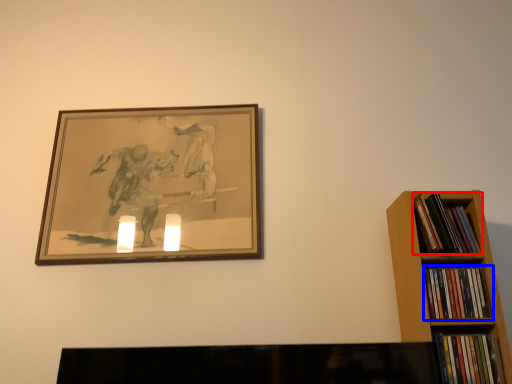
Question: Among these objects, which one is farthest to the camera, book (highlighted by a red box) or book (highlighted by a blue box)?

Choices:
 (A) book
 (B) book

Answer: (A)